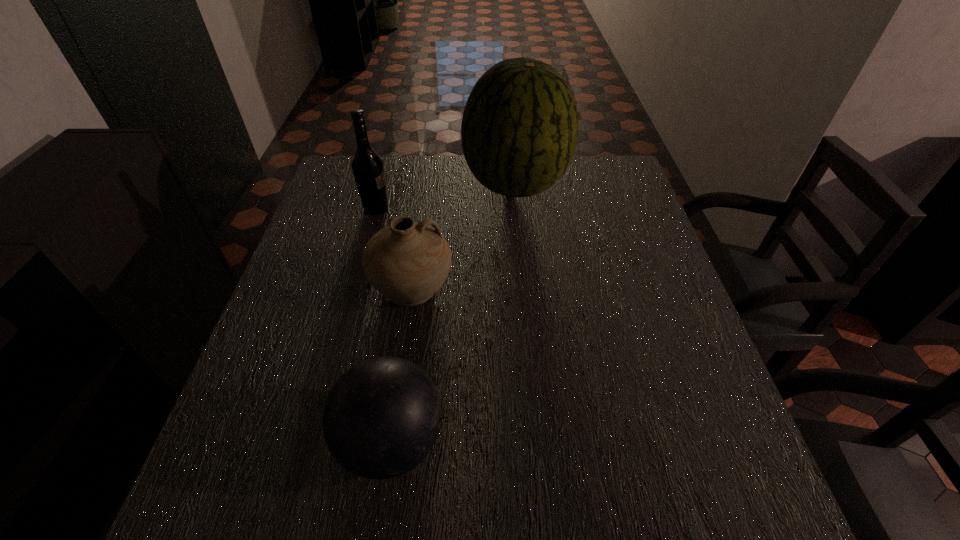
Find the location of a particular element. the tallest object is located at coordinates (519, 129).

This screenshot has height=540, width=960. Find the location of `the rightmost object`. the rightmost object is located at coordinates (519, 129).

Identify the location of the second tallest object. The height and width of the screenshot is (540, 960). (368, 169).

The height and width of the screenshot is (540, 960). Identify the location of pottery. (407, 262).

The width and height of the screenshot is (960, 540). I want to click on bowling ball, so click(x=381, y=418).

This screenshot has width=960, height=540. What are the coordinates of `free space located 0.200m on the front of the watermelon` in the screenshot? It's located at (523, 271).

This screenshot has height=540, width=960. In order to click on free spot located on the label of the third shortest object in this screenshot , I will do `click(462, 208)`.

Where is `vacant space situated 0.100m on the left of the second nearest object`? vacant space situated 0.100m on the left of the second nearest object is located at coordinates (327, 286).

Locate an element on the screen. This screenshot has width=960, height=540. vacant space situated 0.230m on the grip area of the nearest object is located at coordinates (576, 441).

You are a GUI agent. You are given a task and a screenshot of the screen. Output one action in this format:
    pyautogui.click(x=<x>, y=<y>)
    Task: Click on the watermelon that is at the far edge
    The width and height of the screenshot is (960, 540).
    Given the screenshot: What is the action you would take?
    pyautogui.click(x=519, y=129)